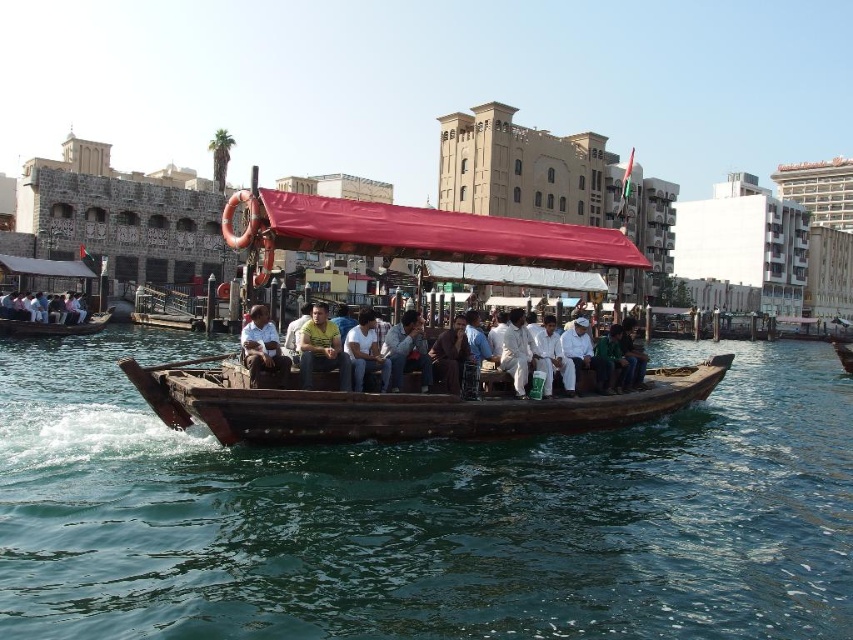
Question: Which point is closer to the camera?

Choices:
 (A) white cotton shirt at left
 (B) yellow cotton shirt at center

Answer: (B)

Question: Which of these objects is positioned farthest from the light brown wooden boat at center?

Choices:
 (A) white cotton shirt at center
 (B) yellow cotton shirt at center

Answer: (A)

Question: Does wooden boat at center have a lesser width compared to yellow cotton shirt at center?

Choices:
 (A) yes
 (B) no

Answer: (B)

Question: Which object is farther from the camera taking this photo?

Choices:
 (A) brown wooden boat at center
 (B) white cotton shirt at left
 (C) yellow cotton shirt at center
 (D) wooden boat at center

Answer: (B)

Question: Is brown wooden boat at center above yellow cotton shirt at center?

Choices:
 (A) yes
 (B) no

Answer: (B)

Question: Does brown wooden boat at center come in front of light brown wooden boat at center?

Choices:
 (A) yes
 (B) no

Answer: (A)